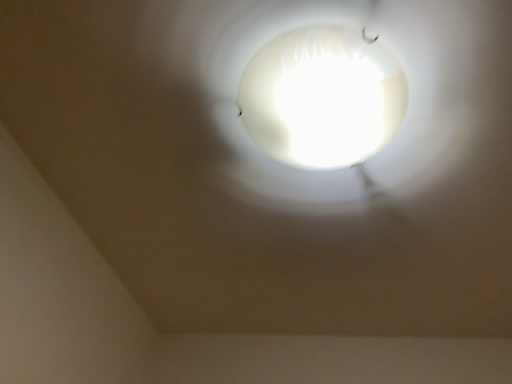
Question: In which direction should I rotate to look at white frosted glass light bulb at upper center?

Choices:
 (A) left
 (B) right

Answer: (B)